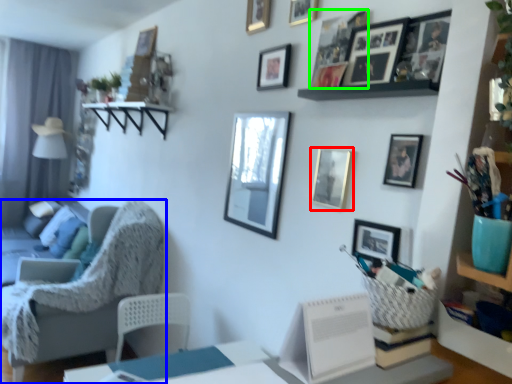
Question: Which object is the farthest from picture frame (highlighted by a red box)? Choose among these: chair (highlighted by a blue box) or picture frame (highlighted by a green box).

Choices:
 (A) chair
 (B) picture frame

Answer: (A)